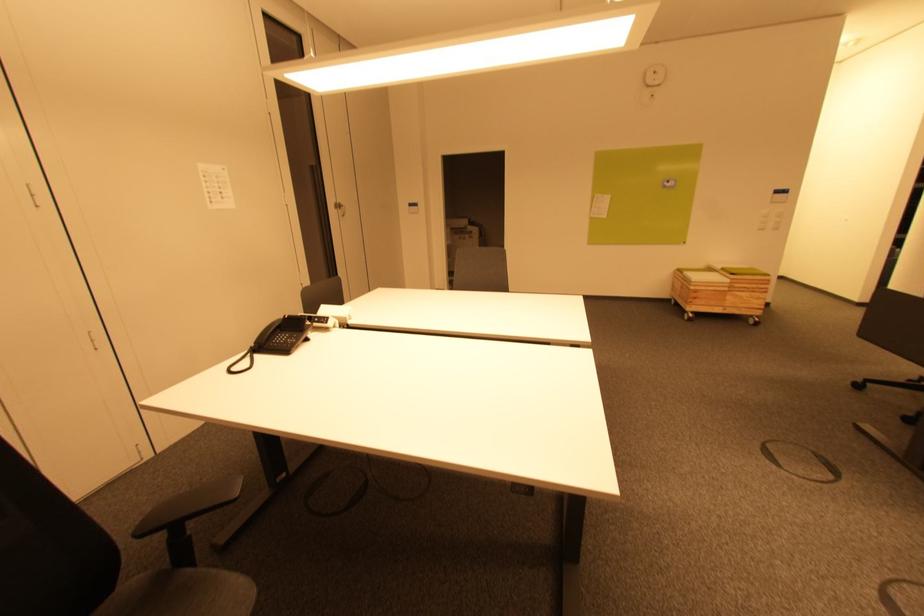
The image size is (924, 616). I want to click on black telephone handset, so click(268, 331).